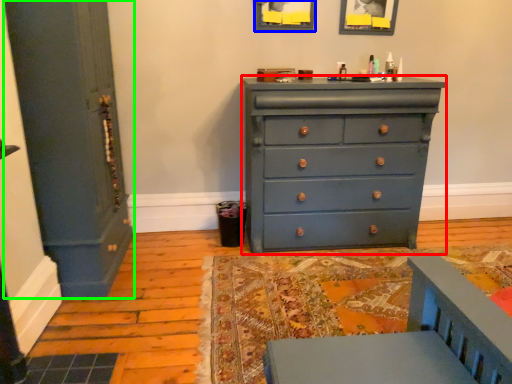
Question: Estimate the real-world distances between objects in this image. Which object is closer to chest of drawers (highlighted by a red box), picture frame (highlighted by a blue box) or door (highlighted by a green box)?

Choices:
 (A) picture frame
 (B) door

Answer: (A)